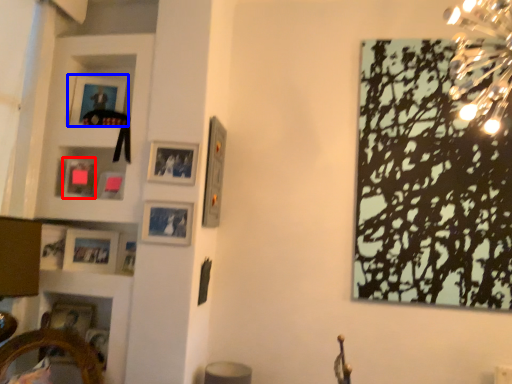
Question: Which point is closer to the camera, picture frame (highlighted by a red box) or picture frame (highlighted by a blue box)?

Choices:
 (A) picture frame
 (B) picture frame

Answer: (A)